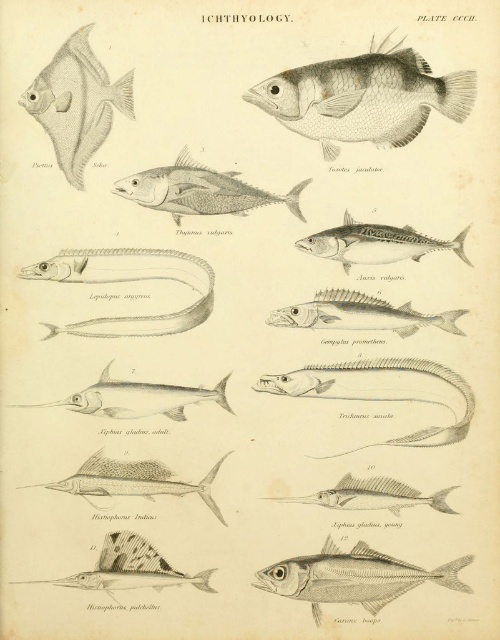
Describe the element at coordinates (77, 104) in the screenshot. I see `translucent silver fish at upper left` at that location.

Does translucent silver fish at upper left have a lesser width compared to silver metallic eel at center?

Yes, translucent silver fish at upper left is thinner than silver metallic eel at center.

Is point (47, 128) in front of point (191, 266)?

Yes, it is.

I want to click on translucent silver fish at upper left, so click(x=77, y=104).

Who is positioned more to the right, grayish silver fish at center or silver metallic mackerel at center?

silver metallic mackerel at center

Locate an element on the screen. Image resolution: width=500 pixels, height=640 pixels. grayish silver fish at center is located at coordinates (200, 189).

Who is more forward, (151, 186) or (326, 253)?

Positioned in front is point (151, 186).

At what (x,y) coordinates should I click in order to perform the action: click on grayish silver fish at center. Please return your answer as a coordinate pair (x, y). This screenshot has width=500, height=640. Looking at the image, I should click on (200, 189).

Measure the distance from grayish silver fish at center to silver metallic sailfish at center.

Answer: 16.04 inches

Which is in front, point (232, 198) or point (120, 484)?

Point (120, 484) is in front.

Does point (185, 212) lie behind point (183, 492)?

Yes, point (185, 212) is behind point (183, 492).

Image resolution: width=500 pixels, height=640 pixels. In order to click on grayish silver fish at center in this screenshot , I will do `click(200, 189)`.